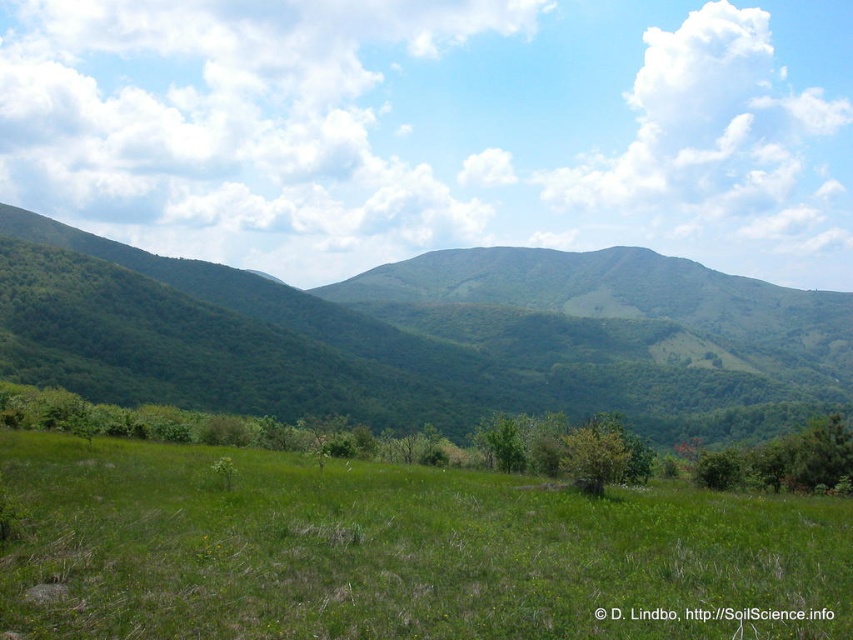
Consider the image. You are standing in the middle of the green grassy field at center and want to walk towards the green leafy tree at center. Which direction should you head to get closer to the tree?

Since the green grassy field at center is closer to the viewer than the green leafy tree at center, you should walk forward towards the tree to get closer to the green leafy tree at center.

You are standing in the meadow and want to take a photo of both the green leafy mountain at center and the green leafy tree at center. Which one should you zoom in on first to ensure it appears larger in your photo?

You should zoom in on the green leafy mountain at center first because it is much taller than the green leafy tree at center, so it will naturally appear larger in the photo.